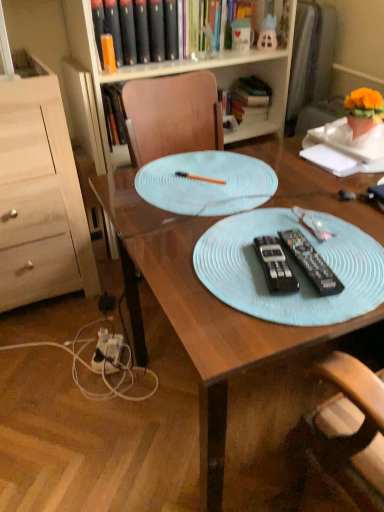
You are a GUI agent. You are given a task and a screenshot of the screen. Output one action in this format:
    pyautogui.click(x=<x>, y=<y>)
    Task: Click on the free space in front of black plastic remote control at center, the 2th remote control positioned from the left
    
    Given the screenshot: What is the action you would take?
    306,315